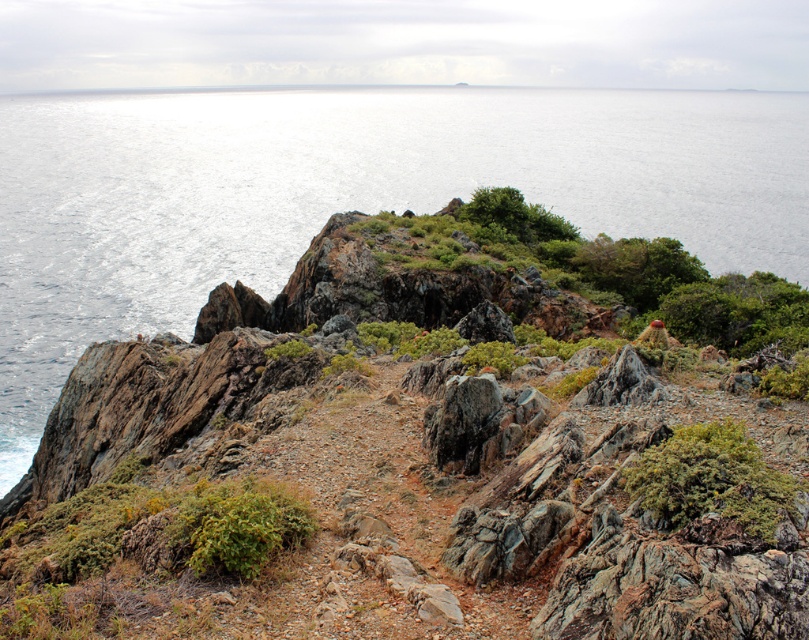
This screenshot has height=640, width=809. Describe the element at coordinates (712, 480) in the screenshot. I see `green fuzzy bush at center right` at that location.

Is green fuzzy bush at center right wider than rusty metallic rock at center?

In fact, green fuzzy bush at center right might be narrower than rusty metallic rock at center.

Is point (665, 468) positioned behind point (498, 438)?

No.

At what (x,y) coordinates should I click in order to perform the action: click on green fuzzy bush at center right. Please return your answer as a coordinate pair (x, y). The image size is (809, 640). Looking at the image, I should click on (712, 480).

From the picture: Can you confirm if glistening silver water at upper left is thinner than rusty metallic rock at center?

Incorrect, glistening silver water at upper left's width is not less than rusty metallic rock at center's.

Is glistening silver water at upper left positioned before rusty metallic rock at center?

No, it is not.

At what (x,y) coordinates should I click in order to perform the action: click on glistening silver water at upper left. Please return your answer as a coordinate pair (x, y). The height and width of the screenshot is (640, 809). Looking at the image, I should click on (344, 195).

Is glistening silver water at upper left taller than green fuzzy bush at center right?

Yes.

Locate an element on the screen. glistening silver water at upper left is located at coordinates (344, 195).

You are a GUI agent. You are given a task and a screenshot of the screen. Output one action in this format:
    pyautogui.click(x=<x>, y=<y>)
    Task: Click on the glistening silver water at upper left
    
    Given the screenshot: What is the action you would take?
    pyautogui.click(x=344, y=195)